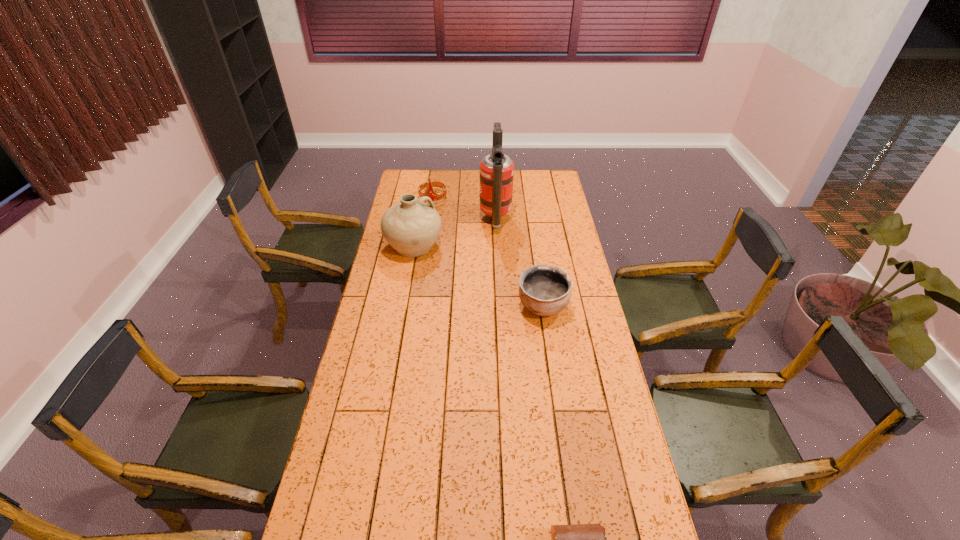
Where is `free space at the far right corner of the desktop`? free space at the far right corner of the desktop is located at coordinates (536, 189).

Find the location of a particular element. This screenshot has width=960, height=540. unoccupied area between the third tallest object and the tallest object is located at coordinates (465, 210).

Image resolution: width=960 pixels, height=540 pixels. I want to click on vacant area that lies between the fire extinguisher and the fourth farthest object, so click(519, 264).

You are a GUI agent. You are given a task and a screenshot of the screen. Output one action in this format:
    pyautogui.click(x=<x>, y=<y>)
    Task: Click on the unoccupied position between the tiara and the shorter pottery
    
    Given the screenshot: What is the action you would take?
    pyautogui.click(x=488, y=253)

The image size is (960, 540). I want to click on vacant area that lies between the shorter pottery and the tallest object, so click(x=519, y=264).

At what (x,y) coordinates should I click in order to perform the action: click on free spot between the tiara and the fourth farthest object. Please return your answer as a coordinate pair (x, y). This screenshot has width=960, height=540. Looking at the image, I should click on (488, 253).

I want to click on free space between the right pottery and the tiara, so click(x=488, y=253).

At what (x,y) coordinates should I click in order to perform the action: click on free space between the taller pottery and the fire extinguisher. Please return your answer as a coordinate pair (x, y). Looking at the image, I should click on (455, 233).

This screenshot has width=960, height=540. What are the coordinates of `object that is the fourth closest to the tallest object` in the screenshot? It's located at (576, 539).

At what (x,y) coordinates should I click in order to perform the action: click on object that can be found as the fourth closest to the third shortest object. Please return your answer as a coordinate pair (x, y). Looking at the image, I should click on (576, 539).